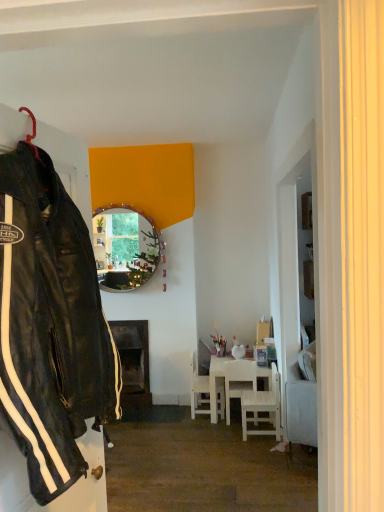
Find the location of `white glossy table at center`. white glossy table at center is located at coordinates (233, 380).

Describe the element at coordinates (199, 392) in the screenshot. Image resolution: width=384 pixels, height=512 pixels. I see `white matte chair at center, placed as the 3th chair when sorted from front to back` at that location.

The height and width of the screenshot is (512, 384). I want to click on white wooden chair at center, the second chair in the front-to-back sequence, so click(x=239, y=380).

You are a GUI agent. You are given a task and a screenshot of the screen. Output one action in this format:
    pyautogui.click(x=<x>, y=<y>)
    Task: Click on the white wooden chair at lower right, positioned as the third chair in back-to-front order
    This screenshot has width=384, height=512.
    Given the screenshot: What is the action you would take?
    click(x=262, y=408)

Who is taller, white glossy table at center or dark wood fireplace at center?

Standing taller between the two is dark wood fireplace at center.

Does white glossy table at center touch dark wood fireplace at center?

white glossy table at center and dark wood fireplace at center are not in contact.

Where is `table below the dark wood fireplace at center (from a real-world perspective)`? table below the dark wood fireplace at center (from a real-world perspective) is located at coordinates (233, 380).

Is white glossy table at center smaller than dark wood fireplace at center?

No.

From a real-world perspective, is black leather jacket at left located beneath white wooden chair at lower right, the first chair when ordered from front to back?

No.

Measure the distance from black leather jacket at left to white wooden chair at lower right, the first chair when ordered from front to back.

The distance of black leather jacket at left from white wooden chair at lower right, the first chair when ordered from front to back, is 2.33 meters.

Does point (60, 438) lie behind point (276, 386)?

No, it is not.

Which object is more forward, black leather jacket at left or white wooden chair at lower right, the first chair when ordered from front to back?

black leather jacket at left is more forward.

At what (x,y) coordinates should I click in order to perform the action: click on the 2nd chair positioned below the matte circular mirror at center (from the image's perspective). Please return your answer as a coordinate pair (x, y). This screenshot has width=384, height=512. Looking at the image, I should click on (239, 380).

Considering the sizes of matte circular mirror at center and white wooden chair at center, the second chair in the front-to-back sequence, in the image, is matte circular mirror at center bigger or smaller than white wooden chair at center, the second chair in the front-to-back sequence,?

matte circular mirror at center is bigger than white wooden chair at center, the second chair in the front-to-back sequence.

Considering the relative sizes of matte circular mirror at center and white wooden chair at center, arranged as the 2th chair when viewed from the back, in the image provided, is matte circular mirror at center wider than white wooden chair at center, arranged as the 2th chair when viewed from the back,?

No.

Is black leather jacket at left next to white matte chair at center, placed as the 3th chair when sorted from front to back?

No, black leather jacket at left is not making contact with white matte chair at center, placed as the 3th chair when sorted from front to back.

Which is closer, (59, 207) or (207, 413)?

Clearly, point (59, 207) is closer to the camera than point (207, 413).

Is black leather jacket at left positioned with its back to white matte chair at center, placed as the 3th chair when sorted from front to back?

No, black leather jacket at left's orientation is not away from white matte chair at center, placed as the 3th chair when sorted from front to back.

Which object is wider, white glossy table at center or matte circular mirror at center?

With larger width is white glossy table at center.

Between white glossy table at center and matte circular mirror at center, which one has less height?

white glossy table at center is shorter.

From a real-world perspective, between white glossy table at center and matte circular mirror at center, who is vertically higher?

From a 3D spatial view, matte circular mirror at center is above.

Is point (247, 378) closer to camera compared to point (126, 229)?

Yes, it is.

From the image's perspective, is black leather jacket at left above or below matte circular mirror at center?

black leather jacket at left is situated lower than matte circular mirror at center in the image.

Considering the sizes of black leather jacket at left and matte circular mirror at center in the image, is black leather jacket at left bigger or smaller than matte circular mirror at center?

Clearly, black leather jacket at left is larger in size than matte circular mirror at center.

From a real-world perspective, is black leather jacket at left physically located above or below matte circular mirror at center?

black leather jacket at left is situated higher than matte circular mirror at center in the real world.

Is black leather jacket at left not close to matte circular mirror at center?

→ Indeed, black leather jacket at left is not near matte circular mirror at center.

Where is `mirror above the white matte chair at center, placed as the 3th chair when sorted from front to back (from a real-world perspective)`? The width and height of the screenshot is (384, 512). mirror above the white matte chair at center, placed as the 3th chair when sorted from front to back (from a real-world perspective) is located at coordinates (125, 248).

Based on the photo, considering the relative positions of matte circular mirror at center and white matte chair at center, placed as the 3th chair when sorted from front to back, in the image provided, is matte circular mirror at center to the right of white matte chair at center, placed as the 3th chair when sorted from front to back, from the viewer's perspective?

In fact, matte circular mirror at center is to the left of white matte chair at center, placed as the 3th chair when sorted from front to back.

Looking at this image, from the image's perspective, between matte circular mirror at center and white matte chair at center, placed as the 3th chair when sorted from front to back, who is located below?

white matte chair at center, placed as the 3th chair when sorted from front to back, is shown below in the image.

Locate an element on the screen. fireplace that is above the white glossy table at center (from a real-world perspective) is located at coordinates (133, 361).

Which chair is the 3rd one when counting from the right side of the black leather jacket at left? Please provide its 2D coordinates.

[(262, 408)]

Estimate the real-world distances between objects in this image. Which object is closer to white matte chair at center, placed as the 3th chair when sorted from front to back, white glossy table at center or black leather jacket at left?

A: Based on the image, white glossy table at center appears to be nearer to white matte chair at center, placed as the 3th chair when sorted from front to back.

From the image, which object appears to be farther from white glossy table at center, dark wood fireplace at center or black leather jacket at left?

Based on the image, black leather jacket at left appears to be further to white glossy table at center.

Based on the photo, looking at the image, which one is located closer to dark wood fireplace at center, black leather jacket at left or white glossy table at center?

Among the two, white glossy table at center is located nearer to dark wood fireplace at center.

Looking at the image, which one is located closer to dark wood fireplace at center, white matte chair at center, placed as the 3th chair when sorted from front to back, or matte circular mirror at center?

The object closer to dark wood fireplace at center is white matte chair at center, placed as the 3th chair when sorted from front to back.

When comparing their distances from white glossy table at center, does matte circular mirror at center or white wooden chair at lower right, positioned as the third chair in back-to-front order, seem closer?

white wooden chair at lower right, positioned as the third chair in back-to-front order.

Which object lies further to the anchor point dark wood fireplace at center, white matte chair at center, placed as the 3th chair when sorted from front to back, or white glossy table at center?

white glossy table at center lies further to dark wood fireplace at center than the other object.

Estimate the real-world distances between objects in this image. Which object is further from black leather jacket at left, white matte chair at center, the 1th chair positioned from the back, or white wooden chair at center, the second chair in the front-to-back sequence?

Based on the image, white matte chair at center, the 1th chair positioned from the back, appears to be further to black leather jacket at left.

Considering their positions, is white wooden chair at center, the second chair in the front-to-back sequence, positioned closer to white wooden chair at lower right, the first chair when ordered from front to back, than white matte chair at center, the 1th chair positioned from the back?

white wooden chair at center, the second chair in the front-to-back sequence.

Find the location of `chair situated between white matte chair at center, the 1th chair positioned from the back, and white glossy table at center from left to right`. chair situated between white matte chair at center, the 1th chair positioned from the back, and white glossy table at center from left to right is located at coordinates (239, 380).

Find the location of a particular element. This screenshot has width=384, height=512. fireplace between matte circular mirror at center and white glossy table at center in the up-down direction is located at coordinates (133, 361).

I want to click on mirror located between black leather jacket at left and dark wood fireplace at center in the depth direction, so (x=125, y=248).

This screenshot has width=384, height=512. Find the location of `chair positioned between white wooden chair at lower right, positioned as the third chair in back-to-front order, and white matte chair at center, placed as the 3th chair when sorted from front to back, from near to far`. chair positioned between white wooden chair at lower right, positioned as the third chair in back-to-front order, and white matte chair at center, placed as the 3th chair when sorted from front to back, from near to far is located at coordinates (239, 380).